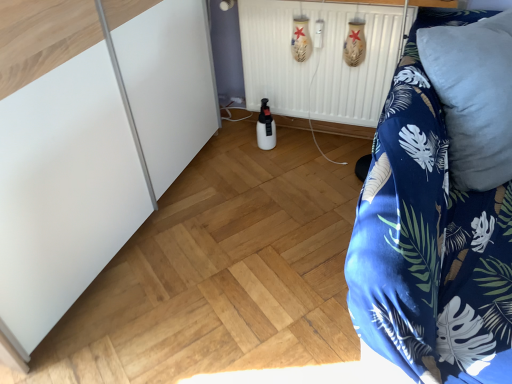
Where is `vacant area situated to the left side of white matte bottle at center`? The height and width of the screenshot is (384, 512). vacant area situated to the left side of white matte bottle at center is located at coordinates (232, 148).